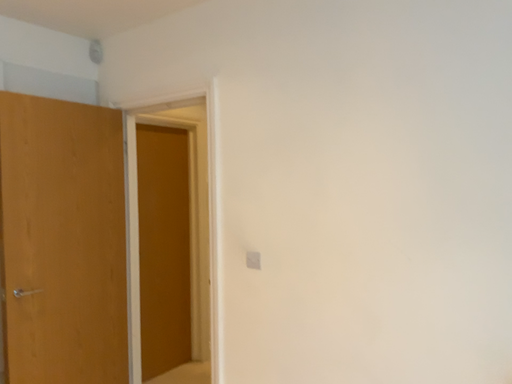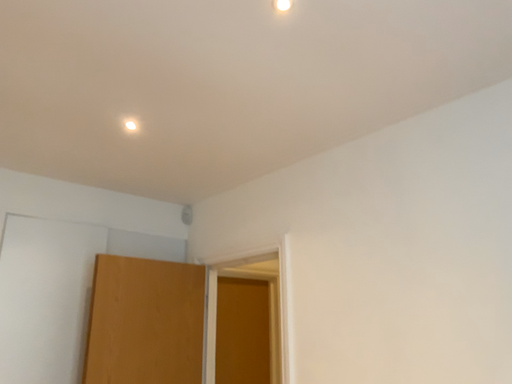
Question: How did the camera likely rotate when shooting the video?

Choices:
 (A) rotated downward
 (B) rotated upward

Answer: (B)